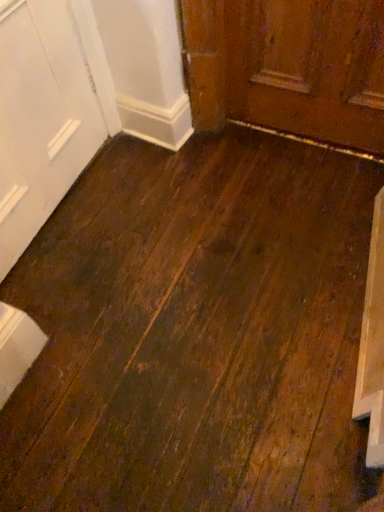
Describe the element at coordinates (41, 118) in the screenshot. I see `white painted wood door at left` at that location.

Find the location of a particular element. Image resolution: width=384 pixels, height=512 pixels. white painted wood door at left is located at coordinates (41, 118).

Measure the distance between point [20,217] and camera.

Point [20,217] is 1.48 meters away from camera.

At what (x,y) coordinates should I click in order to perform the action: click on white painted wood door at left. Please return your answer as a coordinate pair (x, y). Looking at the image, I should click on (41, 118).